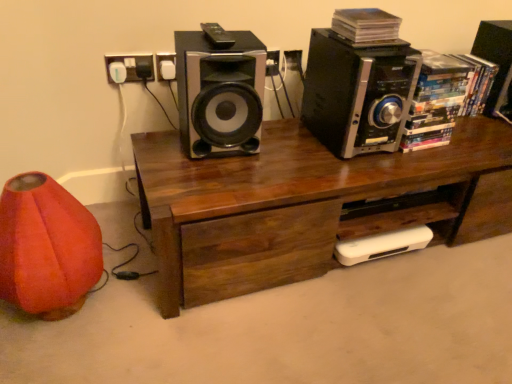
Locate an element on the screen. The width and height of the screenshot is (512, 384). empty space that is ontop of metallic silver speaker at center, which is counted as the 1th speaker, starting from the left (from a real-world perspective) is located at coordinates (223, 34).